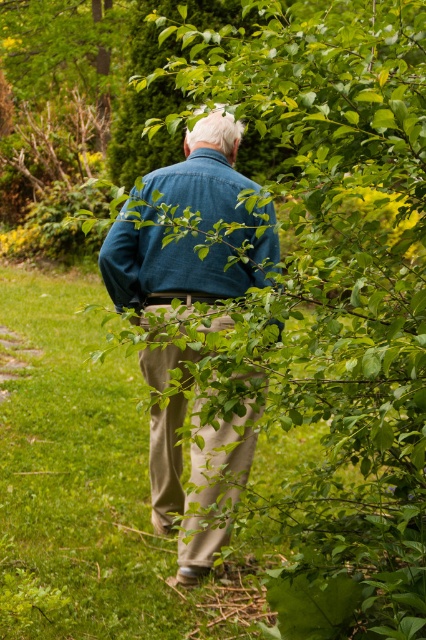
Question: Does denim jacket at center appear under khaki pants at center?

Choices:
 (A) no
 (B) yes

Answer: (A)

Question: Among these points, which one is nearest to the camera?

Choices:
 (A) (14, 413)
 (B) (183, 291)
 (C) (204, 561)

Answer: (C)

Question: Based on their relative distances, which object is nearer to the denim jacket at center?

Choices:
 (A) khaki pants at center
 (B) green grass at center
 (C) denim shirt at center

Answer: (A)

Question: Is green grass at center bigger than denim shirt at center?

Choices:
 (A) yes
 (B) no

Answer: (A)

Question: Considering the relative positions of green grass at center and denim jacket at center in the image provided, where is green grass at center located with respect to denim jacket at center?

Choices:
 (A) right
 (B) left

Answer: (B)

Question: Which point is farther to the camera?

Choices:
 (A) (68, 621)
 (B) (155, 376)
 (C) (146, 349)

Answer: (B)